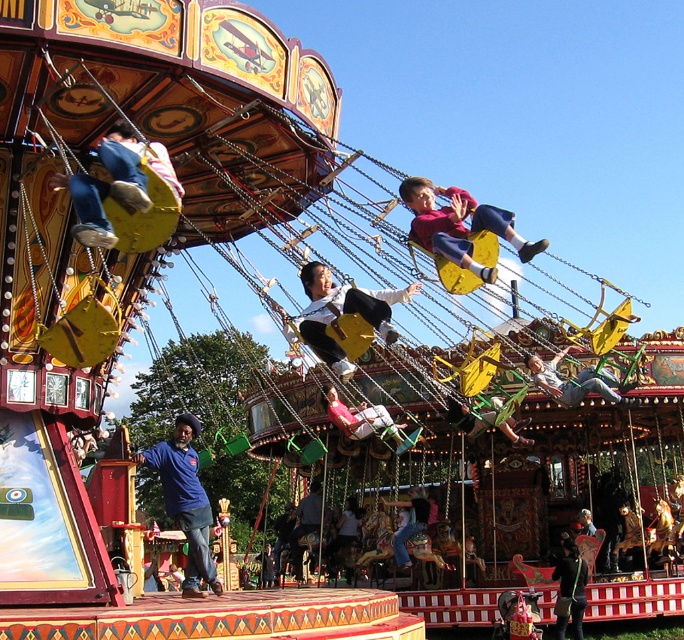
Is matte yellow swing at center to the right of light brown wooden swing at center from the viewer's perspective?

Correct, you'll find matte yellow swing at center to the right of light brown wooden swing at center.

Which is below, matte yellow swing at center or light brown wooden swing at center?

light brown wooden swing at center

At what (x,y) coordinates should I click in order to perform the action: click on matte yellow swing at center. Please return your answer as a coordinate pair (x, y). This screenshot has width=684, height=640. Looking at the image, I should click on (460, 225).

In the scene shown: Who is lower down, light pink fabric at center or green fabric swing at center?

green fabric swing at center is below.

I want to click on light pink fabric at center, so click(356, 417).

I want to click on light pink fabric at center, so click(x=356, y=417).

Is point (319, 342) farther from viewer compared to point (354, 419)?

That is False.

Can you confirm if yellow fabric swing at center is shorter than light pink fabric at center?

No.

Where is `yellow fabric swing at center`? yellow fabric swing at center is located at coordinates (341, 314).

Identify the location of yellow fabric swing at center. The image size is (684, 640). (341, 314).